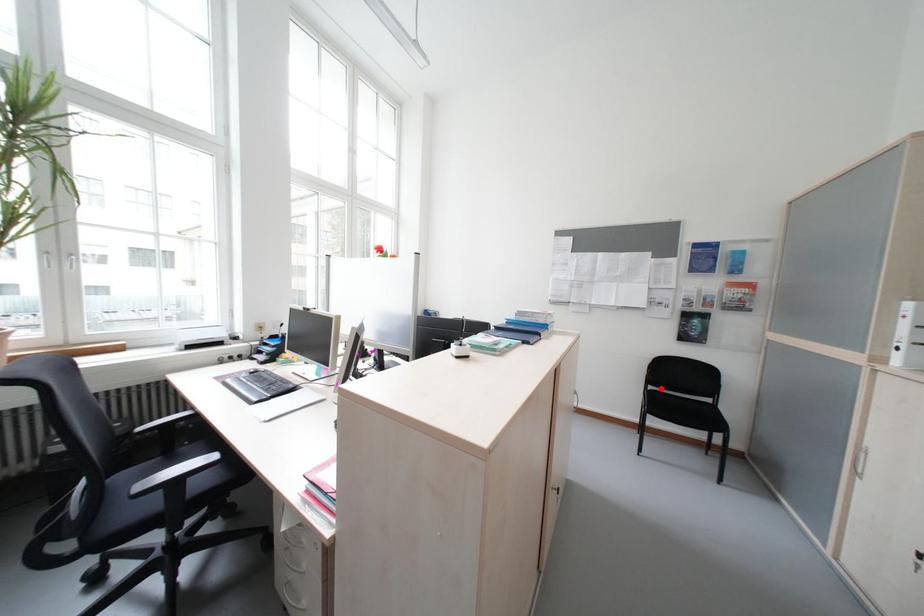
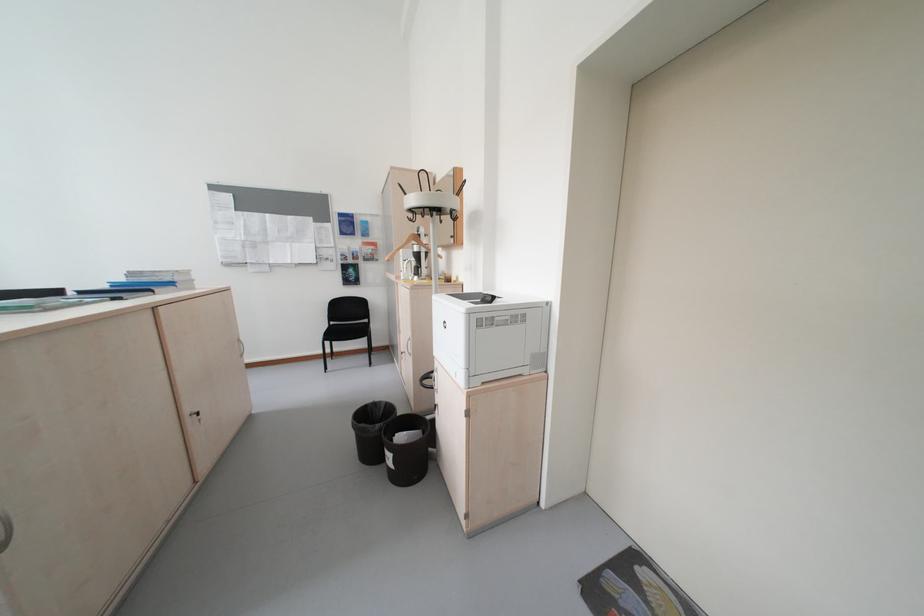
Find the pixel in the second image that matches the highlighted location in the first image.

(343, 323)